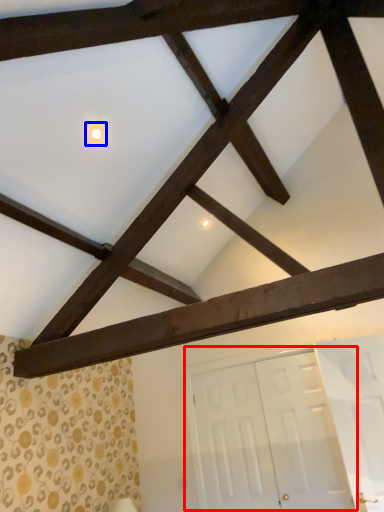
Question: Which object appears closest to the camera in this image, door (highlighted by a red box) or light (highlighted by a blue box)?

Choices:
 (A) door
 (B) light

Answer: (B)